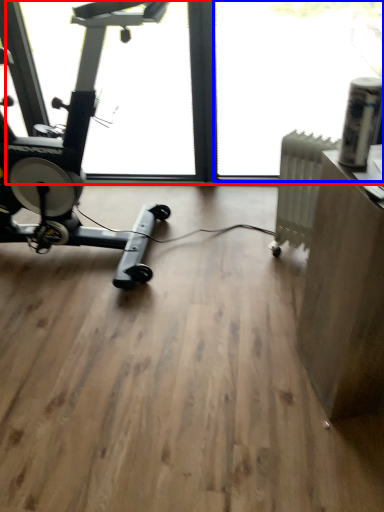
Question: Which object appears closest to the camera in this image, window screen (highlighted by a red box) or window screen (highlighted by a blue box)?

Choices:
 (A) window screen
 (B) window screen

Answer: (A)